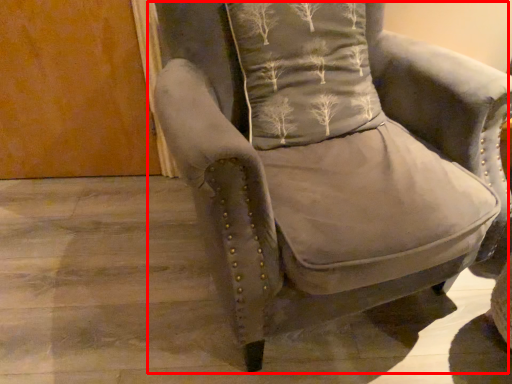
Question: From the image's perspective, what is the correct spatial relationship of chair (annotated by the red box) in relation to pillow?

Choices:
 (A) above
 (B) below

Answer: (B)